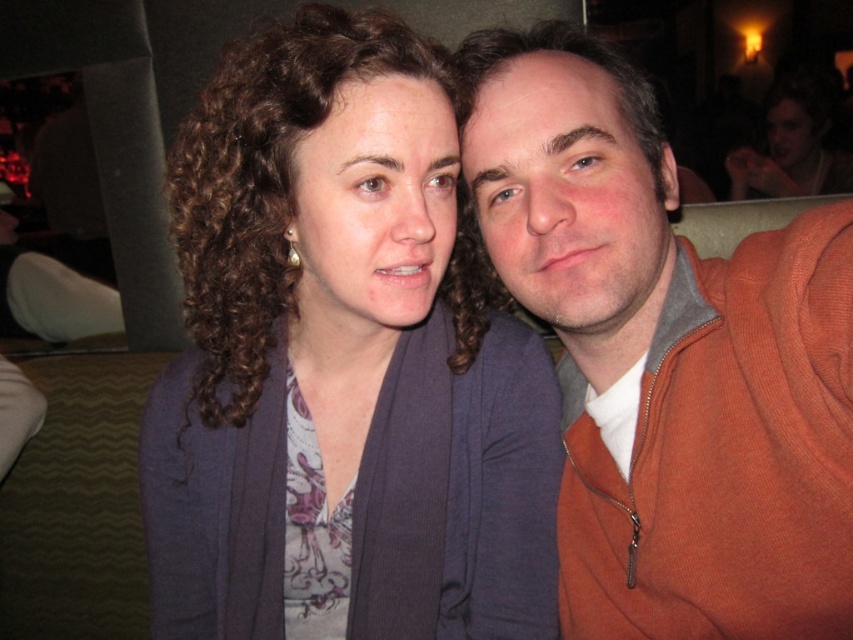
Question: Which of the following is the farthest from the observer?

Choices:
 (A) (643, 384)
 (B) (349, 257)

Answer: (A)

Question: Which point is farther to the camera?

Choices:
 (A) orange zip-up sweater at right
 (B) matte blue cardigan at center

Answer: (B)

Question: Can you confirm if matte blue cardigan at center is wider than orange zip-up sweater at right?

Choices:
 (A) no
 (B) yes

Answer: (B)

Question: Does matte blue cardigan at center have a lesser width compared to orange zip-up sweater at right?

Choices:
 (A) no
 (B) yes

Answer: (A)

Question: Which point is closer to the camera taking this photo?

Choices:
 (A) click(x=740, y=611)
 (B) click(x=199, y=609)

Answer: (A)

Question: Is matte blue cardigan at center to the left of orange zip-up sweater at right from the viewer's perspective?

Choices:
 (A) no
 (B) yes

Answer: (B)